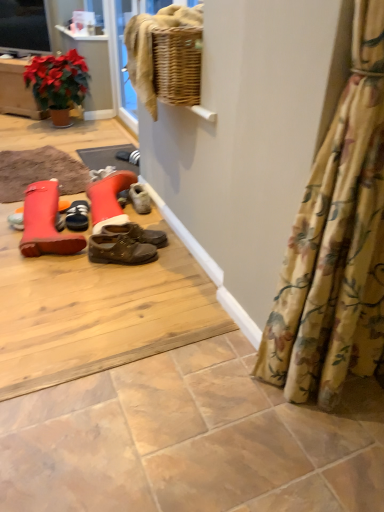
Question: Considering the relative positions of leather boot at left, which is the 1th footwear from front to back, and matte black television at upper left in the image provided, is leather boot at left, which is the 1th footwear from front to back, to the left or to the right of matte black television at upper left?

Choices:
 (A) left
 (B) right

Answer: (B)

Question: From their relative heights in the image, would you say leather boot at left, acting as the 2th footwear starting from the back, is taller or shorter than matte black television at upper left?

Choices:
 (A) short
 (B) tall

Answer: (A)

Question: Based on their relative distances, which object is farther from the floral fabric curtain at lower right?

Choices:
 (A) black suede shoes at center, acting as the second footwear starting from the front
 (B) leather boot at left, acting as the 2th footwear starting from the back
 (C) matte black television at upper left

Answer: (C)

Question: Estimate the real-world distances between objects in this image. Which object is farther from the black suede shoes at center, which is the 1th footwear in back-to-front order?

Choices:
 (A) matte black television at upper left
 (B) leather boot at left, which is the 1th footwear from front to back
 (C) floral fabric curtain at lower right

Answer: (A)